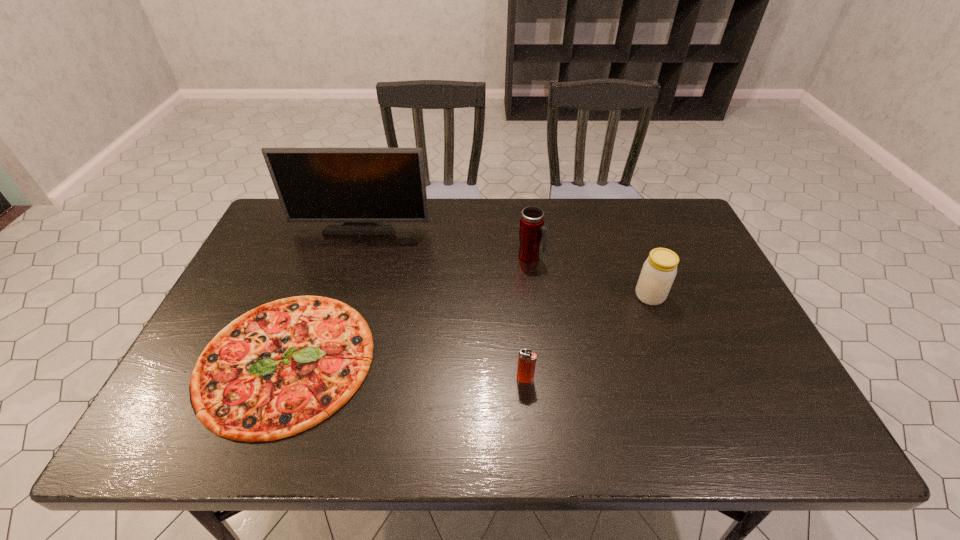
Identify the location of vacant region located 0.240m on the right of the shortest object. This screenshot has height=540, width=960. (472, 360).

The image size is (960, 540). Find the location of `object that is at the far edge`. object that is at the far edge is located at coordinates (360, 190).

Locate an element on the screen. This screenshot has height=540, width=960. object at the near edge is located at coordinates (279, 369).

Identify the location of monitor present at the left edge. This screenshot has height=540, width=960. (360, 190).

The height and width of the screenshot is (540, 960). Identify the location of pizza that is at the left edge. [279, 369].

The height and width of the screenshot is (540, 960). I want to click on object that is at the far left corner, so click(360, 190).

Locate an element on the screen. The height and width of the screenshot is (540, 960). object situated at the near left corner is located at coordinates (279, 369).

Image resolution: width=960 pixels, height=540 pixels. Find the location of `vacant area at the far edge`. vacant area at the far edge is located at coordinates (492, 205).

The height and width of the screenshot is (540, 960). Find the location of `free space at the near edge`. free space at the near edge is located at coordinates (583, 440).

In the image, there is a desktop. Identify the location of free space at the left edge. This screenshot has width=960, height=540. (200, 357).